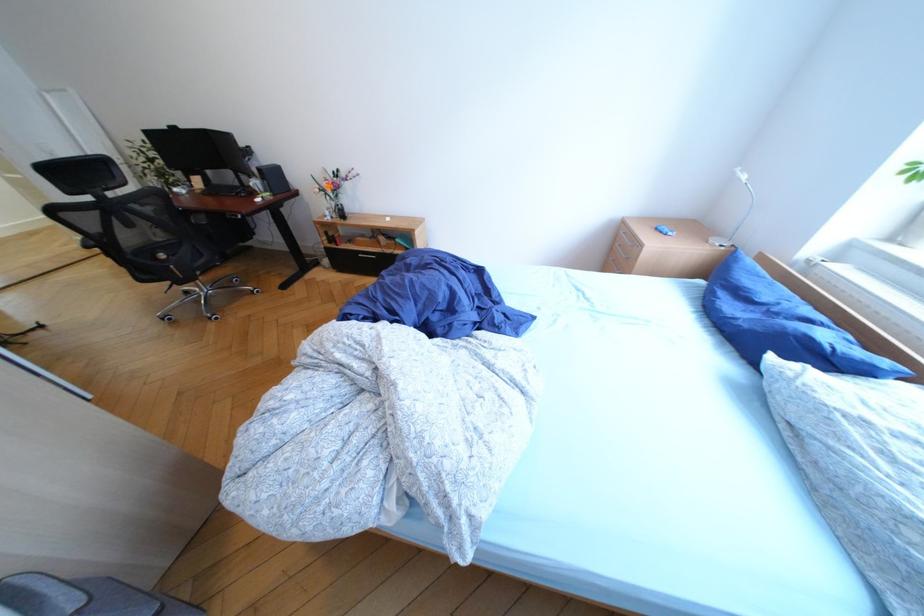
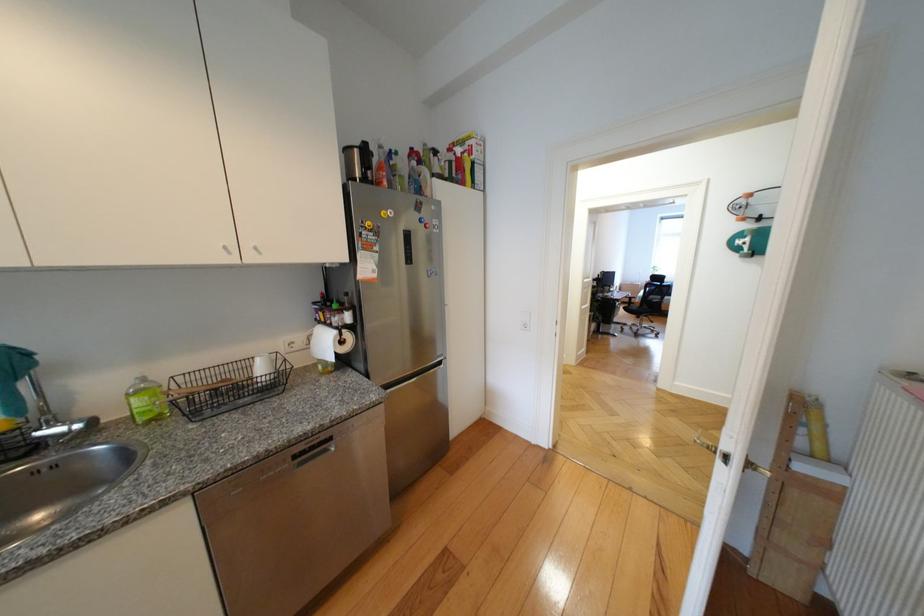
Question: I am providing you with two images of the same scene from different viewpoints. After the viewpoint changes to image2, which objects are now occluded?

Choices:
 (A) dishwasher handle
 (B) white gooseneck lamp
 (C) green pump bottle
 (D) grey box handle

Answer: (B)